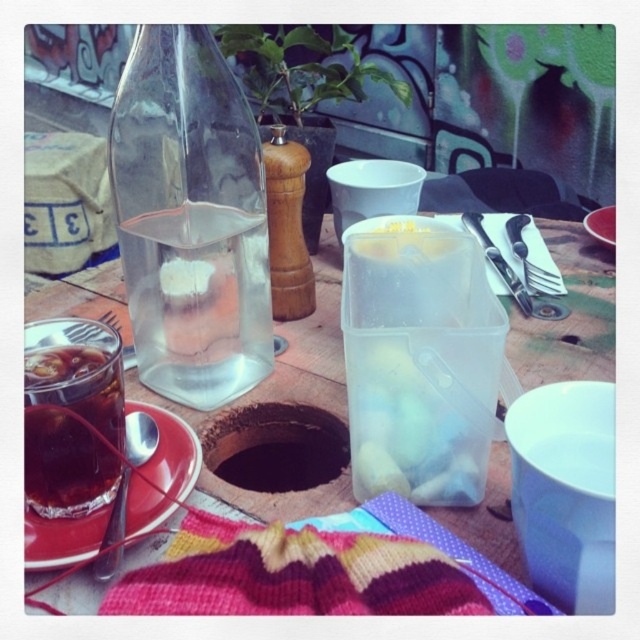
Question: Which is nearer to the shiny metal knife at upper right?

Choices:
 (A) knitted woolen blanket at lower center
 (B) matte ceramic plate at lower left
 (C) satin silver fork at upper right

Answer: (C)

Question: Among these points, which one is farthest from the camera?

Choices:
 (A) (150, 509)
 (B) (120, 150)
 (C) (563, 292)

Answer: (C)

Question: Does knitted woolen blanket at lower center have a lesser width compared to shiny metal spoon at lower left?

Choices:
 (A) no
 (B) yes

Answer: (A)

Question: Is transparent plastic container at center above shiny metal spoon at lower left?

Choices:
 (A) yes
 (B) no

Answer: (A)

Question: Is shiny metal spoon at lower left bigger than shiny metal knife at upper right?

Choices:
 (A) no
 (B) yes

Answer: (A)

Question: Which object is the farthest from the matte ceramic plate at lower left?

Choices:
 (A) knitted woolen blanket at lower center
 (B) transparent plastic container at center

Answer: (B)